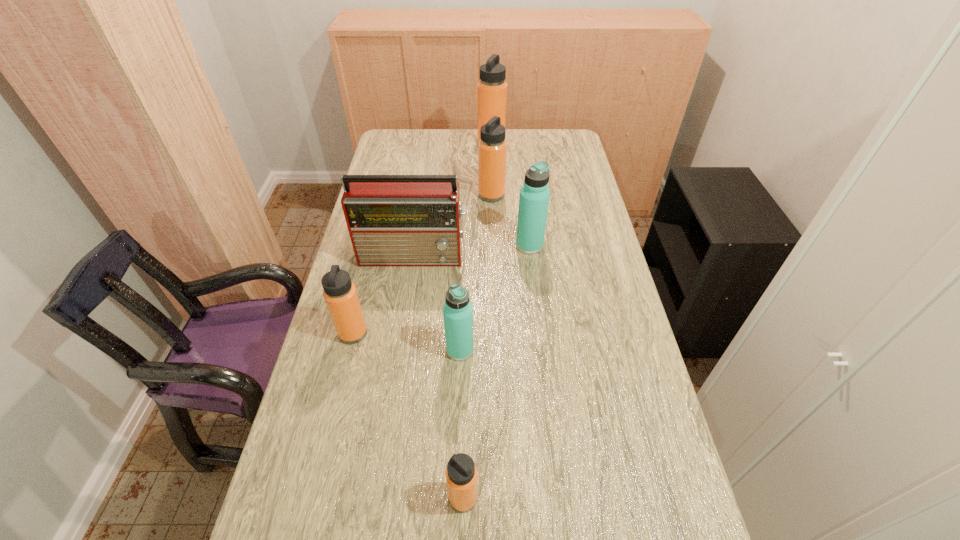
Locate an element on the screen. object that is at the far edge is located at coordinates (492, 88).

This screenshot has width=960, height=540. Identify the location of radio receiver situated at the left edge. (393, 220).

Find the location of a particular element. The width and height of the screenshot is (960, 540). thermos bottle that is at the left edge is located at coordinates 340,294.

Image resolution: width=960 pixels, height=540 pixels. I want to click on vacant region at the far edge of the desktop, so click(455, 152).

The height and width of the screenshot is (540, 960). I want to click on vacant space at the left edge, so click(295, 435).

The height and width of the screenshot is (540, 960). In order to click on vacant space at the right edge of the desktop in this screenshot , I will do `click(586, 265)`.

At what (x,y) coordinates should I click in order to perform the action: click on free space between the third farthest thermos bottle and the leftmost thermos bottle. Please return your answer as a coordinate pair (x, y). Image resolution: width=960 pixels, height=540 pixels. Looking at the image, I should click on (442, 289).

Locate an element on the screen. This screenshot has width=960, height=540. free space between the third smallest orange thermos bottle and the bigger aqua thermos bottle is located at coordinates (511, 220).

Find the location of `vacant area that lies between the leftmost orange thermos bottle and the smaller aqua thermos bottle`. vacant area that lies between the leftmost orange thermos bottle and the smaller aqua thermos bottle is located at coordinates (407, 341).

Image resolution: width=960 pixels, height=540 pixels. I want to click on blank region between the smaller aqua thermos bottle and the radio receiver, so click(437, 302).